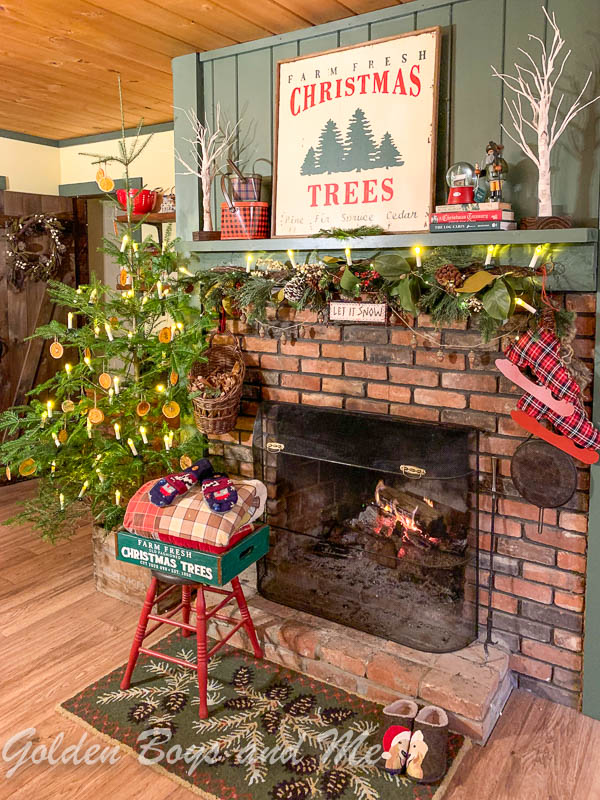
You are a GUI agent. You are given a task and a screenshot of the screen. Output one action in this format:
    pyautogui.click(x=<x>, y=<y>)
    Task: Click on the blonde wooden floor
    
    Given the screenshot: What is the action you would take?
    pyautogui.click(x=39, y=670), pyautogui.click(x=557, y=761), pyautogui.click(x=147, y=794), pyautogui.click(x=17, y=534)